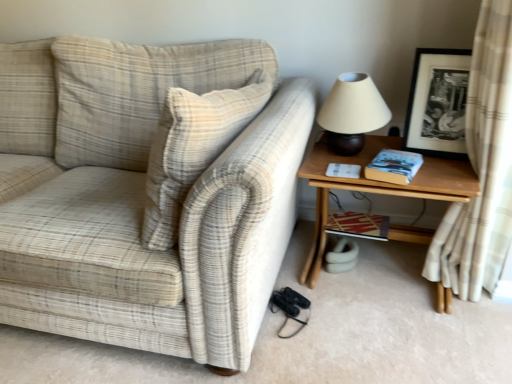
Question: Is striped paper book at lower right, the 2th book from the top, at the right side of beige plaid fabric couch at left?

Choices:
 (A) no
 (B) yes

Answer: (B)

Question: Is striped paper book at lower right, which is counted as the 2th book, starting from the front, aimed at beige plaid fabric couch at left?

Choices:
 (A) no
 (B) yes

Answer: (A)

Question: Does striped paper book at lower right, which ranks as the first book in back-to-front order, have a lesser height compared to beige plaid fabric couch at left?

Choices:
 (A) yes
 (B) no

Answer: (A)

Question: Considering the relative positions of striped paper book at lower right, which ranks as the first book in back-to-front order, and beige plaid fabric couch at left in the image provided, is striped paper book at lower right, which ranks as the first book in back-to-front order, behind beige plaid fabric couch at left?

Choices:
 (A) no
 (B) yes

Answer: (B)

Question: Is striped paper book at lower right, which is counted as the 2th book, starting from the front, outside beige plaid fabric couch at left?

Choices:
 (A) yes
 (B) no

Answer: (A)

Question: Is matte beige lampshade at upper right situated inside hardcover book at right, the first book viewed from the front, or outside?

Choices:
 (A) inside
 (B) outside

Answer: (B)

Question: In terms of height, does matte beige lampshade at upper right look taller or shorter compared to hardcover book at right, which is the 2th book in back-to-front order?

Choices:
 (A) tall
 (B) short

Answer: (A)

Question: Considering the positions of matte beige lampshade at upper right and hardcover book at right, the first book viewed from the front, in the image, is matte beige lampshade at upper right bigger or smaller than hardcover book at right, the first book viewed from the front,?

Choices:
 (A) small
 (B) big

Answer: (B)

Question: Would you say matte beige lampshade at upper right is to the left or to the right of hardcover book at right, the first book viewed from the front, in the picture?

Choices:
 (A) left
 (B) right

Answer: (A)

Question: Considering the relative positions of wooden table at right and beige fabric curtain at right in the image provided, is wooden table at right to the left or to the right of beige fabric curtain at right?

Choices:
 (A) left
 (B) right

Answer: (A)

Question: From the image's perspective, is wooden table at right positioned above or below beige fabric curtain at right?

Choices:
 (A) below
 (B) above

Answer: (A)

Question: Considering the positions of wooden table at right and beige fabric curtain at right in the image, is wooden table at right wider or thinner than beige fabric curtain at right?

Choices:
 (A) thin
 (B) wide

Answer: (B)

Question: Considering the positions of wooden table at right and beige fabric curtain at right in the image, is wooden table at right taller or shorter than beige fabric curtain at right?

Choices:
 (A) short
 (B) tall

Answer: (A)

Question: Considering the relative positions of hardcover book at right, the first book viewed from the front, and matte beige lampshade at upper right in the image provided, is hardcover book at right, the first book viewed from the front, to the left or to the right of matte beige lampshade at upper right?

Choices:
 (A) right
 (B) left

Answer: (A)

Question: Which is correct: hardcover book at right, which is the 2th book in back-to-front order, is inside matte beige lampshade at upper right, or outside of it?

Choices:
 (A) outside
 (B) inside

Answer: (A)